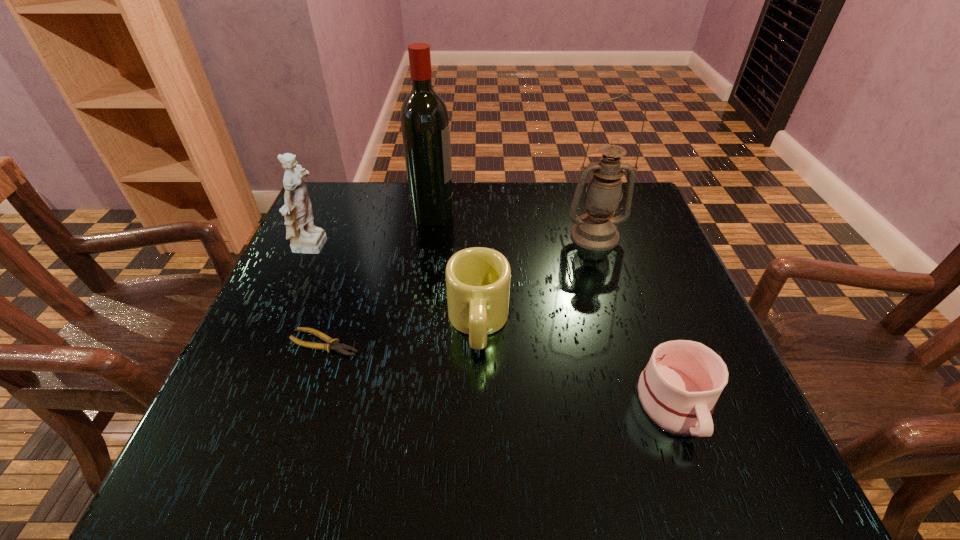
Identify the location of free space located 0.190m on the front-facing side of the third tallest object. The height and width of the screenshot is (540, 960). (415, 248).

Identify the location of vacant position located with the handle on the side of the taller mug. (478, 387).

You are a GUI agent. You are given a task and a screenshot of the screen. Output one action in this format:
    pyautogui.click(x=<x>, y=<y>)
    Task: Click on the free space located on the back of the shortest object
    This screenshot has height=540, width=960.
    Given the screenshot: What is the action you would take?
    pyautogui.click(x=351, y=263)

Find the location of a particular element. wine bottle positioned at the far edge is located at coordinates (425, 126).

Image resolution: width=960 pixels, height=540 pixels. Find the location of `oil lamp at the far edge`. oil lamp at the far edge is located at coordinates (596, 230).

This screenshot has width=960, height=540. What are the coordinates of `object at the near edge` in the screenshot? It's located at (678, 389).

Locate an element on the screen. This screenshot has width=960, height=540. figurine present at the left edge is located at coordinates (304, 237).

Where is `pliers located in the left edge section of the desktop`? This screenshot has width=960, height=540. pliers located in the left edge section of the desktop is located at coordinates (332, 344).

Identify the location of oil lamp that is positioned at the right edge. (596, 230).

This screenshot has width=960, height=540. I want to click on mug located at the right edge, so click(x=678, y=389).